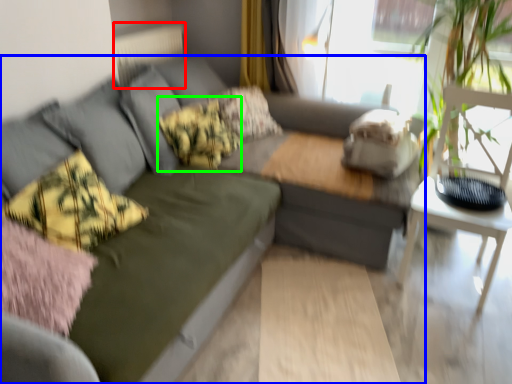
Question: Which object is the closest to the radiator (highlighted by a red box)? Choose among these: studio couch (highlighted by a blue box) or pillow (highlighted by a green box).

Choices:
 (A) studio couch
 (B) pillow

Answer: (B)